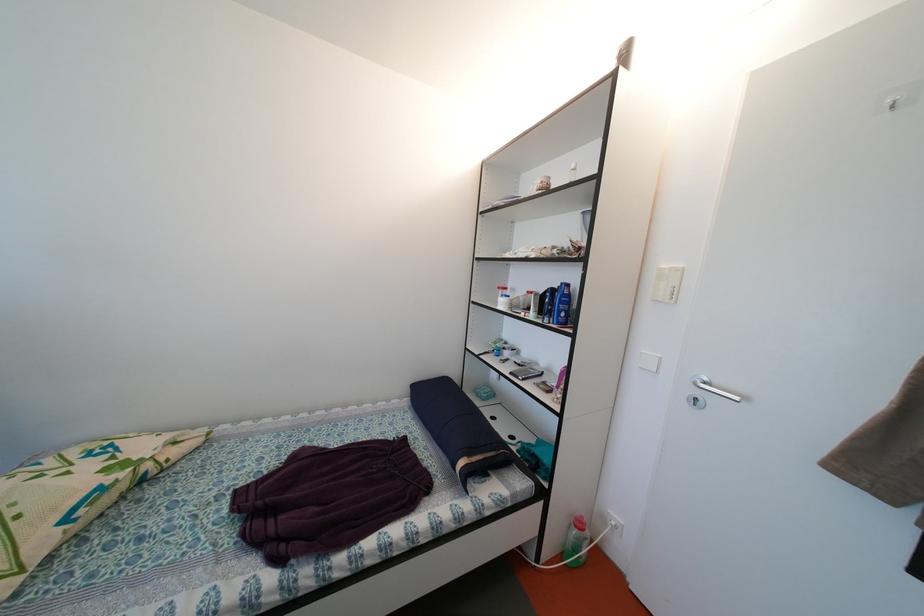
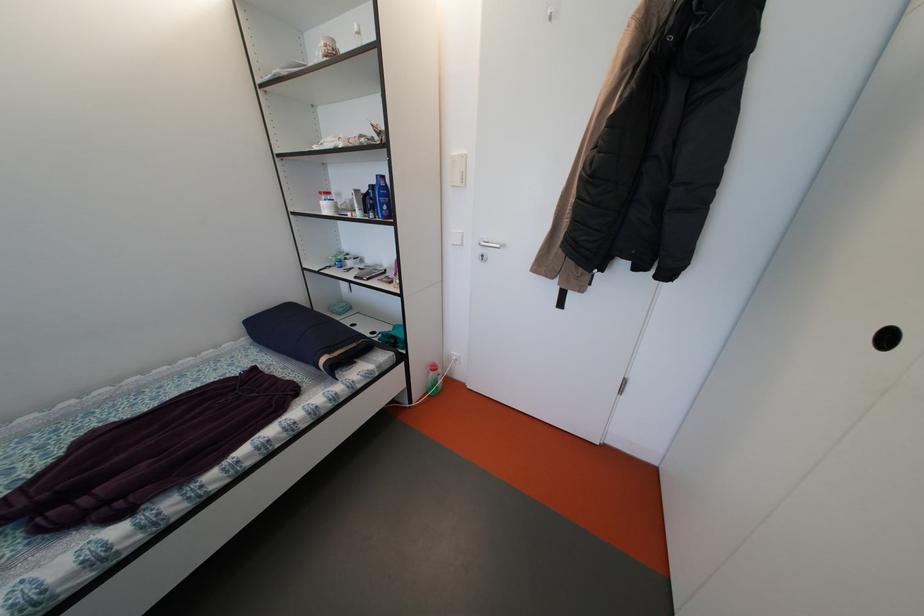
Where in the second image is the point corresponding to [505,293] from the first image?

(327, 198)